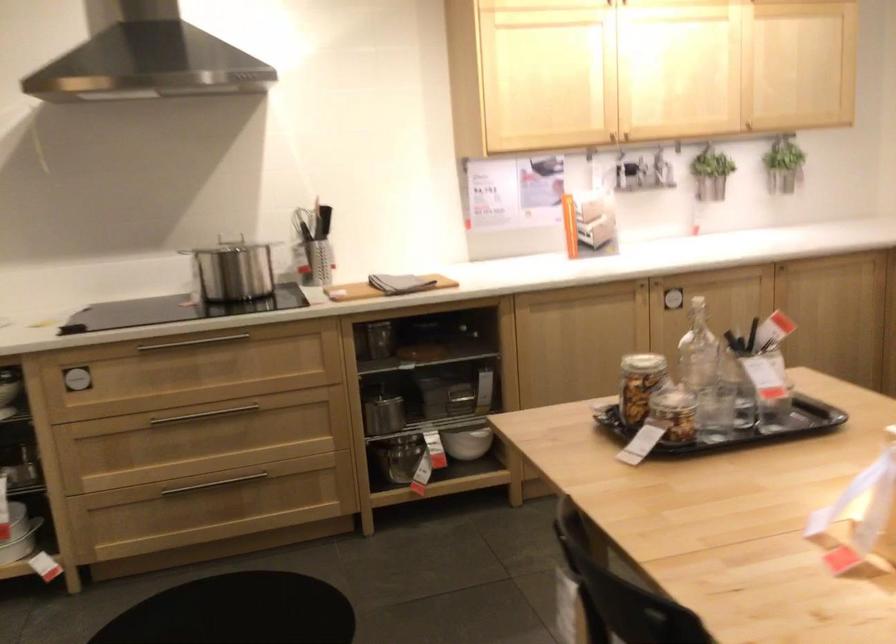
Where would you pour the clear glass bottle? Please return your answer as a coordinate pair (x, y).

(698, 350)